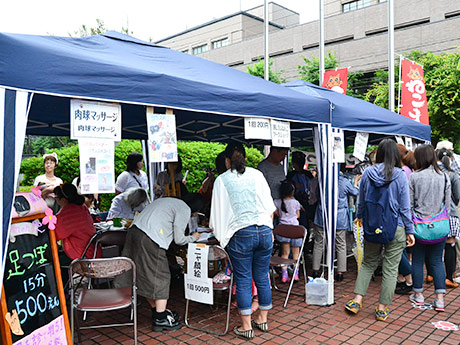
Where is `chalkboard sign`? The height and width of the screenshot is (345, 460). chalkboard sign is located at coordinates (14, 289).